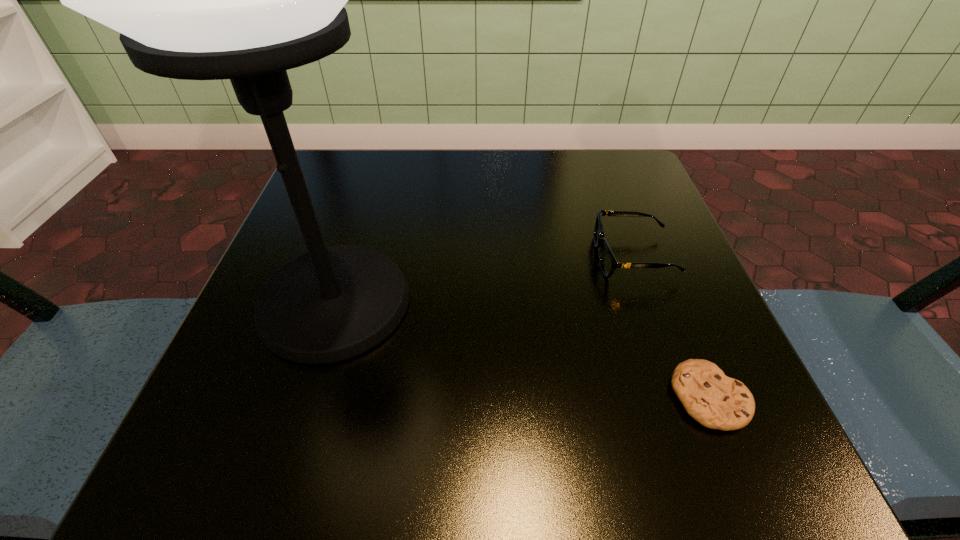
I want to click on object present at the left edge, so 246,0.

Where is `sunglasses at the right edge`? sunglasses at the right edge is located at coordinates (608, 263).

You are a GUI agent. You are given a task and a screenshot of the screen. Output one action in this format:
    pyautogui.click(x=<x>, y=<y>)
    Task: Click on the cookie at the right edge
    
    Given the screenshot: What is the action you would take?
    pyautogui.click(x=716, y=401)

Find the location of `object that is at the near right corner`. object that is at the near right corner is located at coordinates (716, 401).

Locate an element on the screen. This screenshot has width=960, height=540. free space at the far edge is located at coordinates (408, 151).

Find the location of `vacant space at the near edge of the desktop`. vacant space at the near edge of the desktop is located at coordinates (435, 458).

At what (x,y) coordinates should I click in order to perform the action: click on blank space at the right edge of the desktop. Please return your answer as a coordinate pair (x, y). The image size is (960, 540). Looking at the image, I should click on (669, 235).

Identify the location of vacant space at the near left corner. This screenshot has width=960, height=540. (306, 471).

Locate an element on the screen. This screenshot has width=960, height=540. vacant space at the far right corner of the desktop is located at coordinates (636, 185).

Where is `vacant area that lies between the leftmost object and the shortest object`? vacant area that lies between the leftmost object and the shortest object is located at coordinates (522, 350).